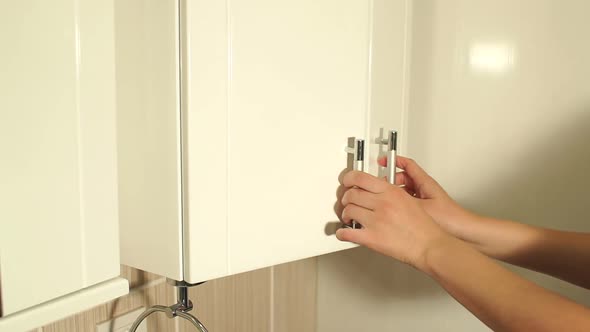
I want to click on shelves, so click(x=273, y=114), click(x=42, y=151).